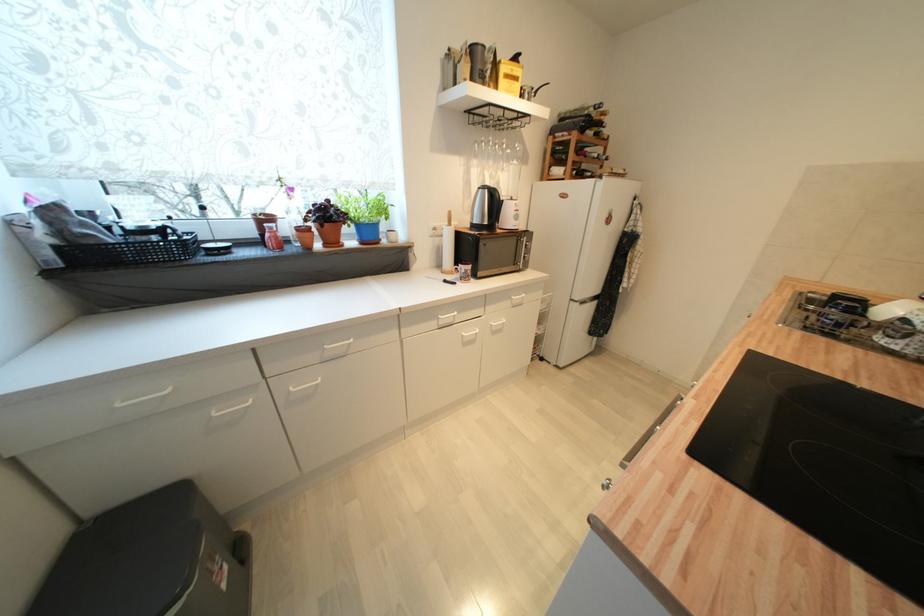
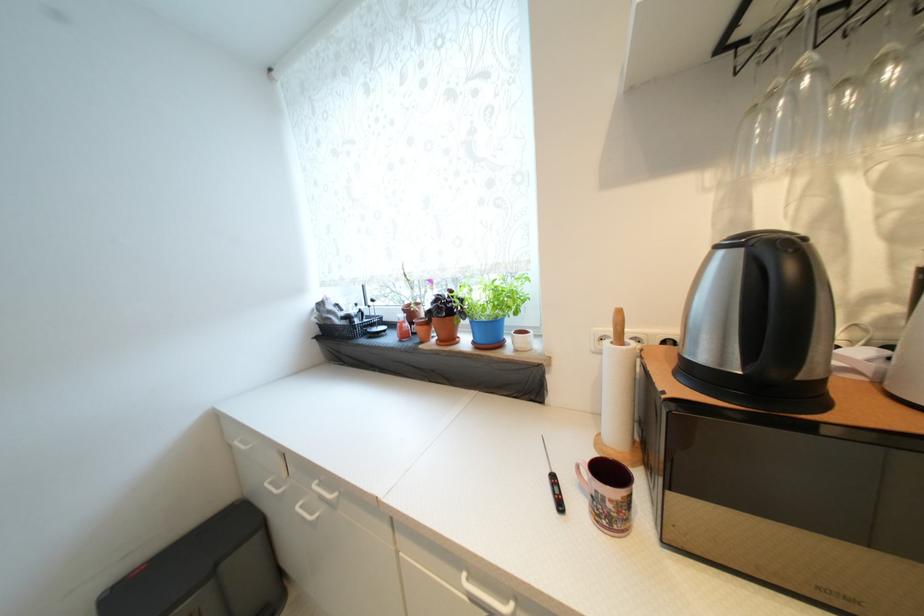
Locate, in the second image, the point that corresponds to pixel 331 246 in the first image.

(445, 342)